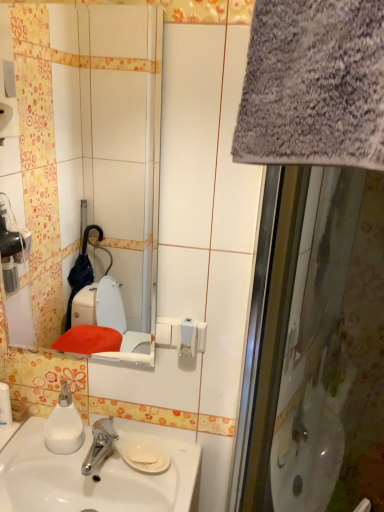
Where is `vacant area that is situated to the right of white matte soap dispenser at lower left`? This screenshot has height=512, width=384. vacant area that is situated to the right of white matte soap dispenser at lower left is located at coordinates (110, 456).